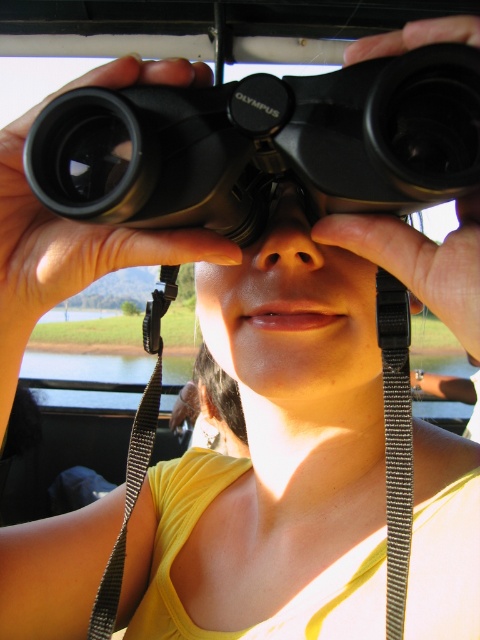
Which is behind, point (175, 198) or point (400, 422)?

Positioned behind is point (400, 422).

Which of these two, black rubber binoculars at center or black textured strap at center, stands shorter?

black rubber binoculars at center

Find the location of a particular element. The width and height of the screenshot is (480, 640). black rubber binoculars at center is located at coordinates (263, 145).

Where is `black rubber binoculars at center`? The image size is (480, 640). black rubber binoculars at center is located at coordinates (263, 145).